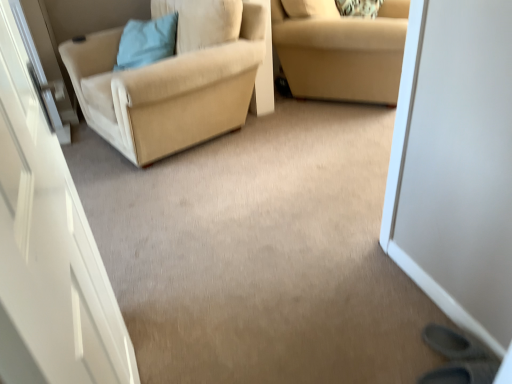
Question: Does beige fabric chair at left have a smaller size compared to beige fabric couch at upper right?

Choices:
 (A) no
 (B) yes

Answer: (A)

Question: Does beige fabric chair at left have a greater width compared to beige fabric couch at upper right?

Choices:
 (A) no
 (B) yes

Answer: (B)

Question: Is beige fabric couch at upper right completely or partially inside beige fabric chair at left?

Choices:
 (A) no
 (B) yes

Answer: (A)

Question: Can you confirm if beige fabric chair at left is bigger than beige fabric couch at upper right?

Choices:
 (A) yes
 (B) no

Answer: (A)

Question: Is beige fabric chair at left with beige fabric couch at upper right?

Choices:
 (A) yes
 (B) no

Answer: (B)

Question: Does beige fabric chair at left come in front of beige fabric couch at upper right?

Choices:
 (A) no
 (B) yes

Answer: (B)

Question: Can you confirm if beige fabric couch at upper right is smaller than light blue fabric pillow at upper left?

Choices:
 (A) no
 (B) yes

Answer: (A)

Question: Is light blue fabric pillow at upper left surrounded by beige fabric couch at upper right?

Choices:
 (A) yes
 (B) no

Answer: (B)

Question: Would you say beige fabric couch at upper right is a long distance from light blue fabric pillow at upper left?

Choices:
 (A) no
 (B) yes

Answer: (B)

Question: Can you confirm if beige fabric couch at upper right is thinner than light blue fabric pillow at upper left?

Choices:
 (A) yes
 (B) no

Answer: (B)

Question: Is beige fabric couch at upper right aimed at light blue fabric pillow at upper left?

Choices:
 (A) yes
 (B) no

Answer: (B)

Question: Is beige fabric couch at upper right behind light blue fabric pillow at upper left?

Choices:
 (A) yes
 (B) no

Answer: (B)

Question: Does beige fabric couch at upper right have a greater height compared to beige fabric chair at left?

Choices:
 (A) yes
 (B) no

Answer: (B)